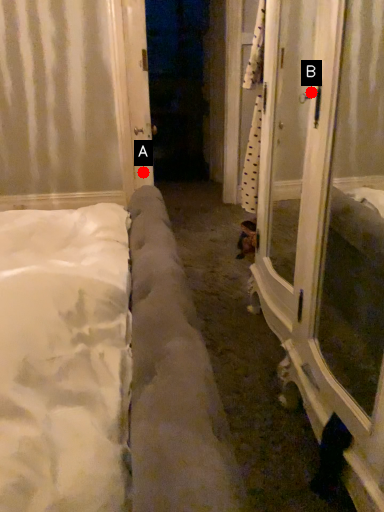
Question: Two points are circled on the image, labeled by A and B beside each circle. Which point is farther to the camera?

Choices:
 (A) A is further
 (B) B is further

Answer: (B)